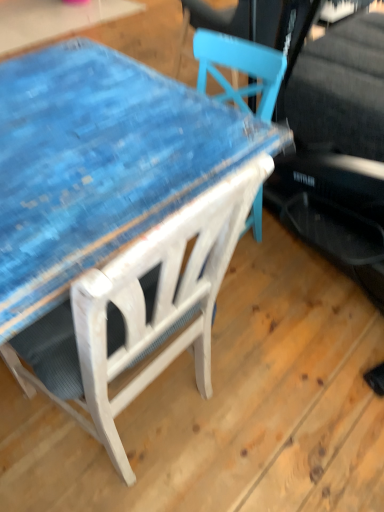
Question: Considering the positions of blue painted wood table at center and white wood chair at upper center in the image, is blue painted wood table at center wider or thinner than white wood chair at upper center?

Choices:
 (A) wide
 (B) thin

Answer: (B)

Question: Considering their positions, is blue painted wood table at center located in front of or behind white wood chair at upper center?

Choices:
 (A) front
 (B) behind

Answer: (B)

Question: Based on their positions, is blue painted wood table at center located to the left or right of white wood chair at upper center?

Choices:
 (A) right
 (B) left

Answer: (A)

Question: From the image's perspective, is white wood chair at upper center positioned above or below blue painted wood table at center?

Choices:
 (A) below
 (B) above

Answer: (A)

Question: Is white wood chair at upper center bigger or smaller than blue painted wood table at center?

Choices:
 (A) big
 (B) small

Answer: (A)

Question: In terms of height, does white wood chair at upper center look taller or shorter compared to blue painted wood table at center?

Choices:
 (A) short
 (B) tall

Answer: (B)

Question: Does point (139, 248) appear closer or farther from the camera than point (0, 218)?

Choices:
 (A) closer
 (B) farther

Answer: (A)